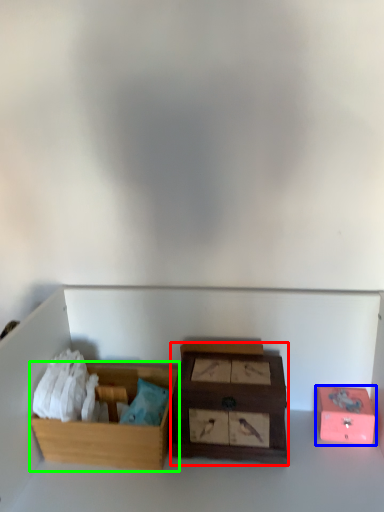
Question: Based on their relative distances, which object is farther from box (highlighted by a red box)? Choose from box (highlighted by a blue box) and box (highlighted by a green box).

Choices:
 (A) box
 (B) box

Answer: (A)